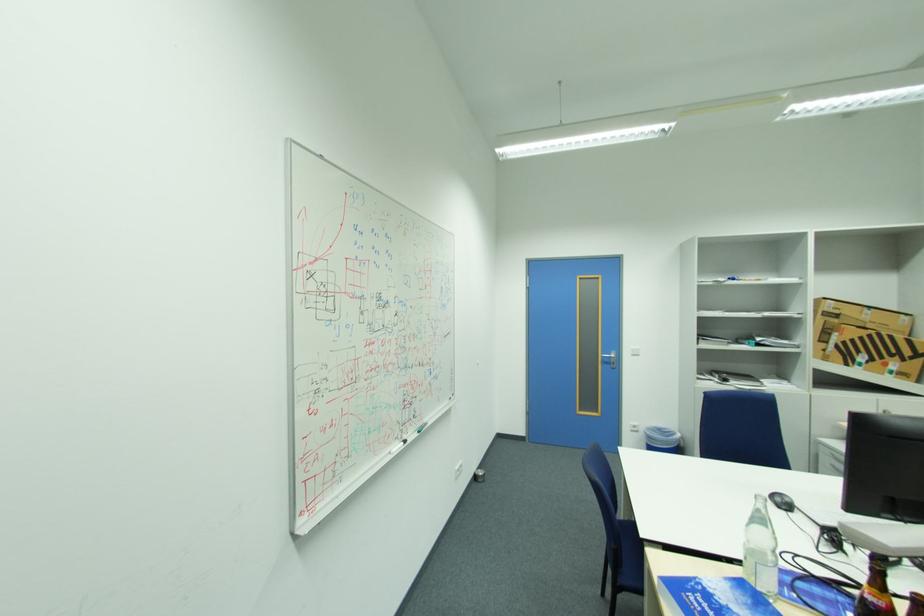
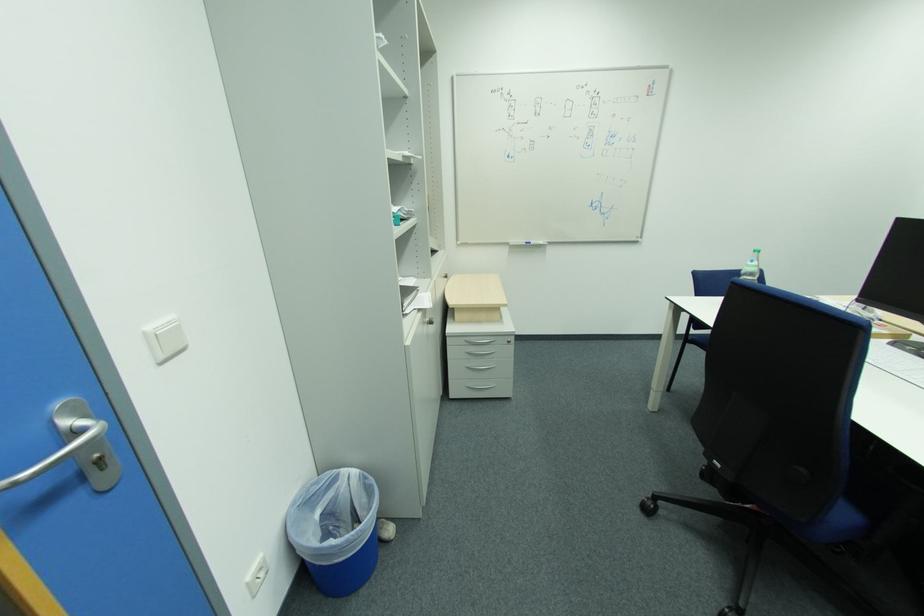
The point at (837,456) is marked in the first image. Where is the corresponding point in the second image?

(471, 342)